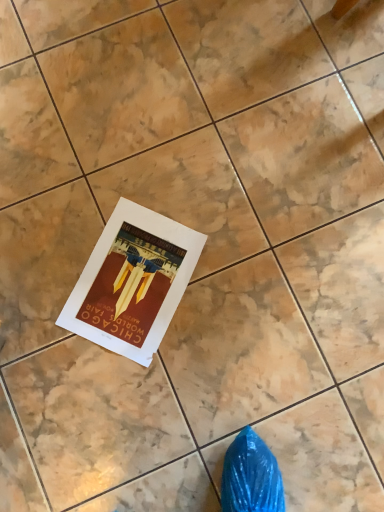
Image resolution: width=384 pixels, height=512 pixels. In order to click on free point to the left of matte paper poster at center in this screenshot , I will do `click(39, 263)`.